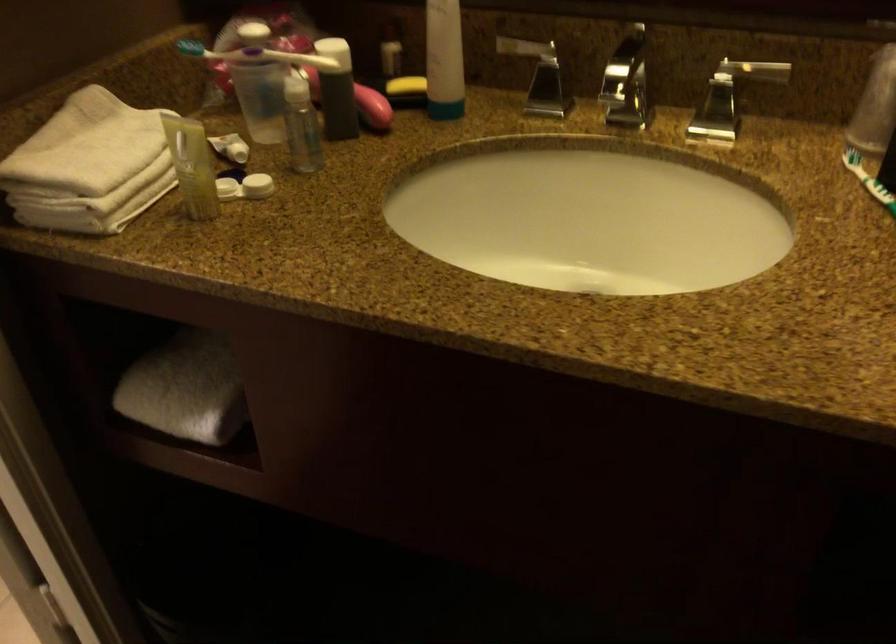
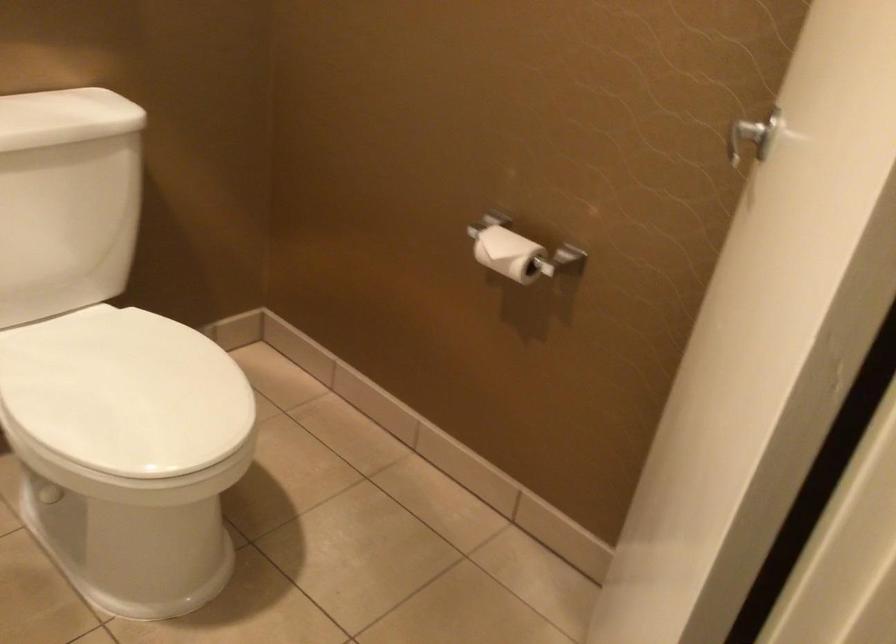
Question: Which direction would the cameraman need to move to produce the second image? Reply with the corresponding letter.

Choices:
 (A) Left
 (B) Right
 (C) Forward
 (D) Backward

Answer: (A)